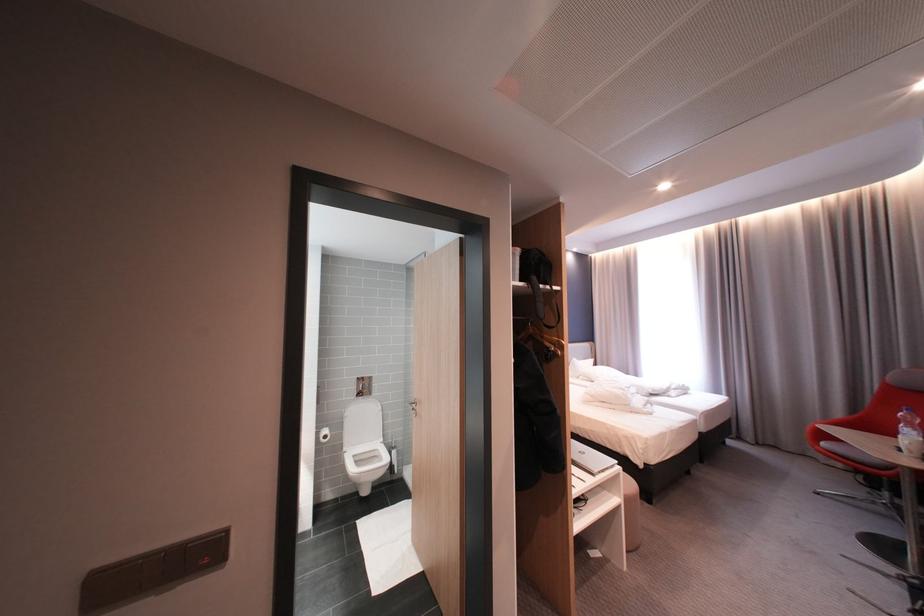
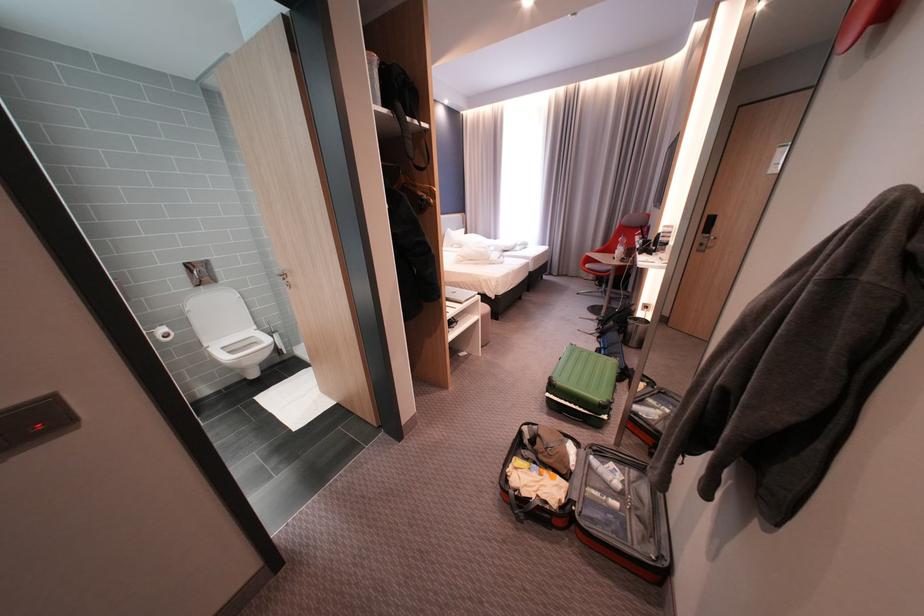
Locate, in the second image, the point that corresponds to (834,445) in the first image.

(598, 265)